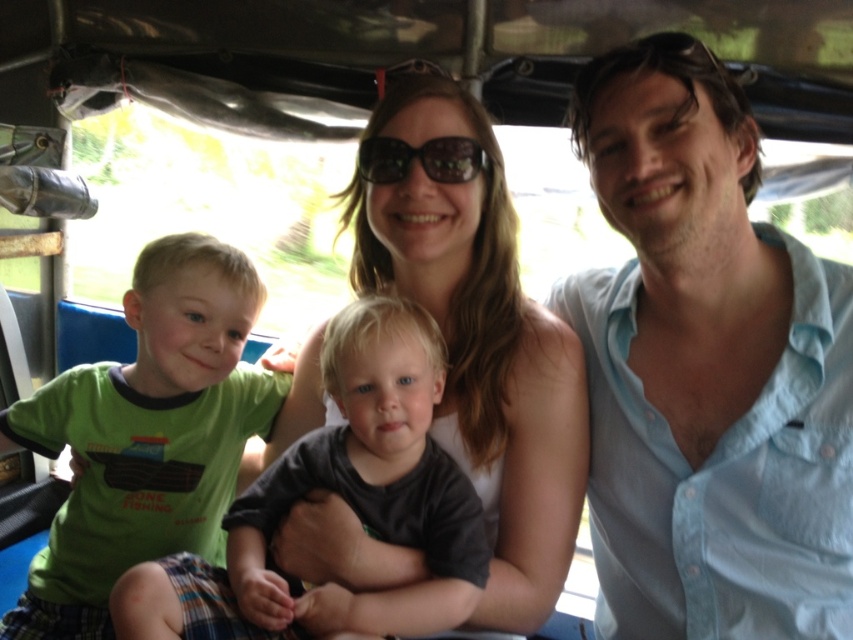
You are standing 1.5 meters away from the vehicle. Can you reach the point at coordinates [207,280] inside the vehicle?

The point at coordinates [207,280] is 1.30 meters from the viewer. Since you are standing 1.5 meters away from the vehicle, you can reach it because the distance to the point is less than your current distance from the vehicle.